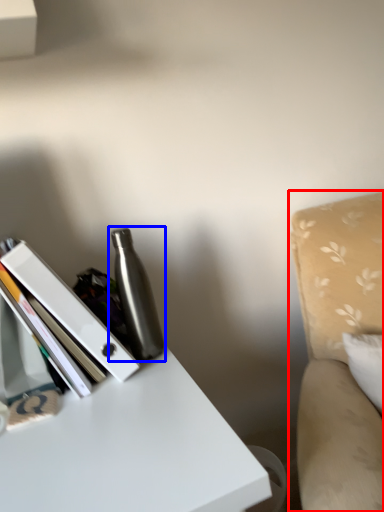
Question: Which point is closer to the camera, swivel chair (highlighted by a red box) or bottle (highlighted by a blue box)?

Choices:
 (A) swivel chair
 (B) bottle

Answer: (A)